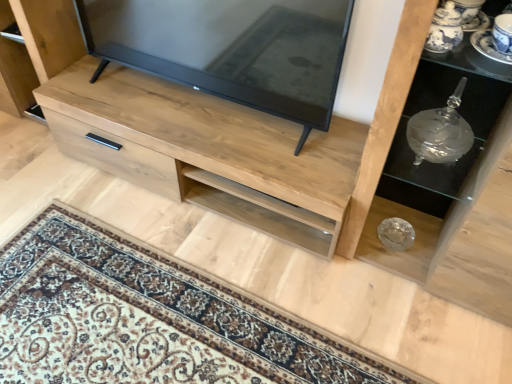
Question: Could you tell me if blue and white porcelain saucer at upper right is turned towards matte black tv at center?

Choices:
 (A) no
 (B) yes

Answer: (A)

Question: Does blue and white porcelain saucer at upper right have a smaller size compared to matte black tv at center?

Choices:
 (A) no
 (B) yes

Answer: (B)

Question: Can you confirm if blue and white porcelain saucer at upper right is wider than matte black tv at center?

Choices:
 (A) no
 (B) yes

Answer: (A)

Question: Considering the relative positions of blue and white porcelain saucer at upper right and matte black tv at center in the image provided, is blue and white porcelain saucer at upper right to the left of matte black tv at center from the viewer's perspective?

Choices:
 (A) yes
 (B) no

Answer: (B)

Question: Can you confirm if blue and white porcelain saucer at upper right is bigger than matte black tv at center?

Choices:
 (A) yes
 (B) no

Answer: (B)

Question: Is natural wood chest of drawers at center in front of or behind clear glass bowl at center, the 1th shelf when ordered from front to back, in the image?

Choices:
 (A) front
 (B) behind

Answer: (B)

Question: Considering the positions of point (348, 139) and point (510, 89), is point (348, 139) closer or farther from the camera than point (510, 89)?

Choices:
 (A) farther
 (B) closer

Answer: (A)

Question: Is natural wood chest of drawers at center inside or outside of clear glass bowl at center, which is counted as the second shelf, starting from the back?

Choices:
 (A) inside
 (B) outside

Answer: (B)

Question: Considering the positions of natural wood chest of drawers at center and clear glass bowl at center, which is counted as the second shelf, starting from the back, in the image, is natural wood chest of drawers at center taller or shorter than clear glass bowl at center, which is counted as the second shelf, starting from the back,?

Choices:
 (A) short
 (B) tall

Answer: (A)

Question: Visually, is blue and white porcelain saucer at upper right positioned to the left or to the right of natural wood chest of drawers at center?

Choices:
 (A) right
 (B) left

Answer: (A)

Question: In terms of height, does blue and white porcelain saucer at upper right look taller or shorter compared to natural wood chest of drawers at center?

Choices:
 (A) short
 (B) tall

Answer: (A)

Question: From a real-world perspective, is blue and white porcelain saucer at upper right positioned above or below natural wood chest of drawers at center?

Choices:
 (A) below
 (B) above

Answer: (B)

Question: From the image's perspective, is blue and white porcelain saucer at upper right located above or below natural wood chest of drawers at center?

Choices:
 (A) below
 (B) above

Answer: (B)

Question: In the image, is matte black tv at center on the left side or the right side of transparent glass vase at right, the second shelf in the front-to-back sequence?

Choices:
 (A) right
 (B) left

Answer: (B)

Question: Do you think matte black tv at center is within transparent glass vase at right, the second shelf in the front-to-back sequence, or outside of it?

Choices:
 (A) outside
 (B) inside

Answer: (A)